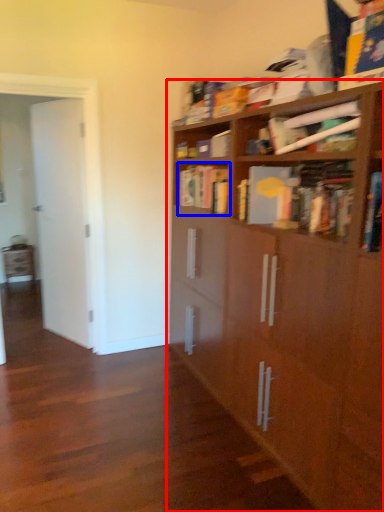
Question: Which object is closer to the camera taking this photo, bookcase (highlighted by a red box) or book (highlighted by a blue box)?

Choices:
 (A) bookcase
 (B) book

Answer: (A)